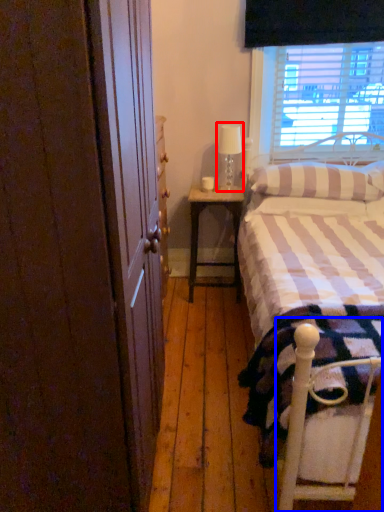
Question: Which object appears farthest to the camera in this image, table lamp (highlighted by a red box) or bed frame (highlighted by a blue box)?

Choices:
 (A) table lamp
 (B) bed frame

Answer: (A)